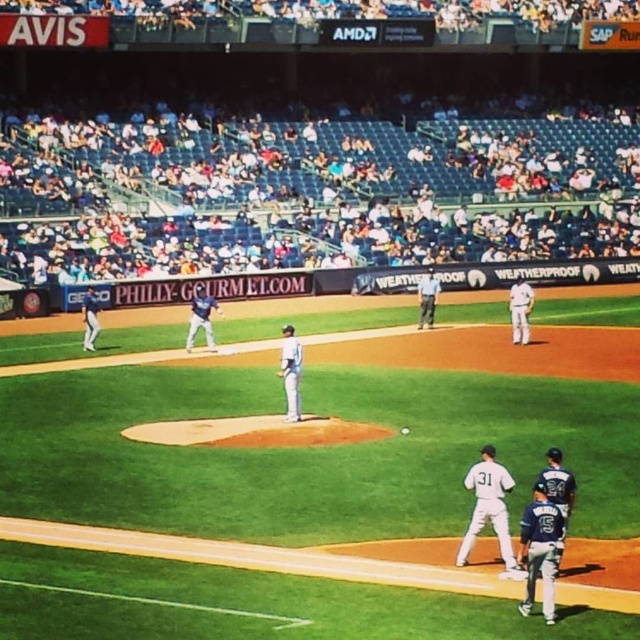
Looking at this image, which of these two, white matte uniform at center or blue uniform at center, stands shorter?

Standing shorter between the two is white matte uniform at center.

Between white matte uniform at center and blue uniform at center, which one is positioned higher?

blue uniform at center

Is point (284, 356) closer to viewer compared to point (205, 324)?

Yes, point (284, 356) is in front of point (205, 324).

Identify the location of white matte uniform at center. (291, 371).

At what (x,y) coordinates should I click in order to perform the action: click on white matte uniform at lower right. Please return your answer as a coordinate pair (x, y). The image size is (640, 640). Looking at the image, I should click on (541, 536).

Is the position of white matte uniform at lower right less distant than that of white matte uniform at center?

Yes, white matte uniform at lower right is closer to the viewer.

Between point (456, 556) and point (291, 352), which one is positioned in front?

Point (456, 556) is more forward.

Find the location of a particular element. The height and width of the screenshot is (640, 640). white matte uniform at lower right is located at coordinates (541, 536).

Who is positioned more to the left, white matte uniform at lower right or white matte baseball player at lower right?

white matte baseball player at lower right

Where is `white matte uniform at lower right`? white matte uniform at lower right is located at coordinates (541, 536).

Identify the location of white matte uniform at lower right. The image size is (640, 640). (541, 536).